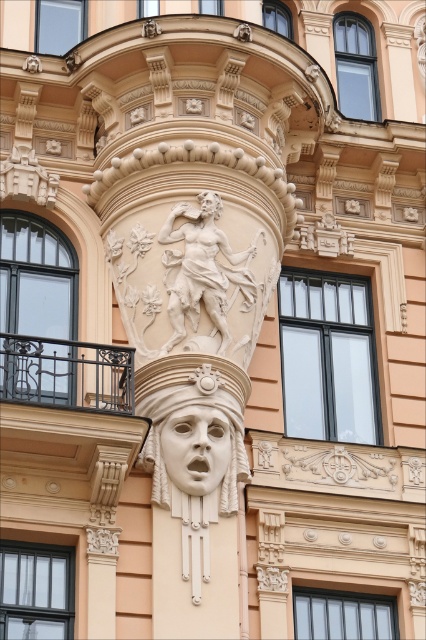
You are an architect designing a replica of this facade. The white stone face at center must be positioned exactly 50 meters away from the entrance. Given the current distance between them is 54.08 meters, how much should you reduce the distance by to meet the requirement?

The current distance between the white stone face at center and the entrance is 54.08 meters. To meet the requirement of 50 meters, you need to reduce the distance by 4.08 meters.

From the picture: You are an architect examining the building facade. You notice two elements, the white stone face at center and the white marble head at center. Which one is taller?

The white stone face at center is taller than the white marble head at center.

You are an art conservator examining the ornate architectural detail. You notice the white stone mask at center and the white marble statue at center. Which object is positioned in front of the other?

The white stone mask at center is closer to the viewer than the white marble statue at center, so it is positioned in front of the white marble statue at center.